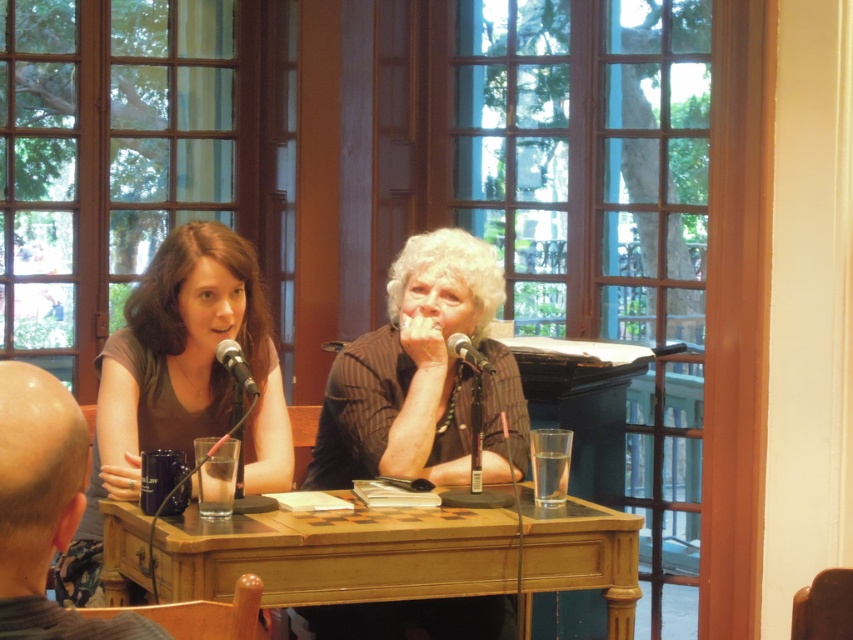
You are a photographer setting up for a portrait session. You need to ensure that the striped fabric shirt at center does not cover the shiny black mug at lower left in the final shot. Based on their current positions, is this possible?

The striped fabric shirt at center is positioned over the shiny black mug at lower left, so adjusting the camera angle or moving the shirt slightly could allow the mug to be visible without obstruction.

You are a photographer setting up for a portrait session. You need to place a new decorative item between the shiny black mug at lower left and the matte black microphone at left. Based on their positions, which object should the new item be closer to?

The shiny black mug at lower left is closer to the viewer than the matte black microphone at left, so the new item should be placed closer to the matte black microphone at left to maintain depth perception.